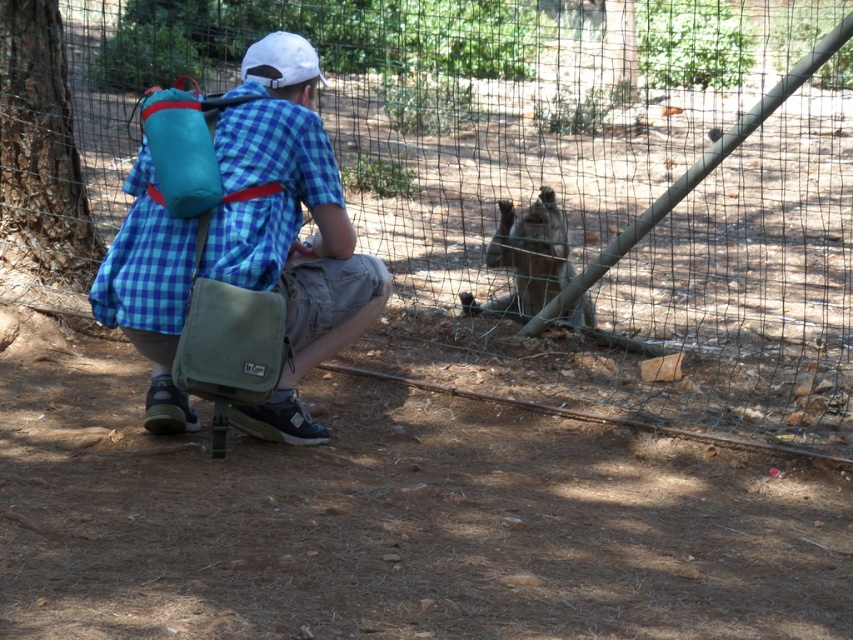
You are standing at the point labeled point (154, 154) and want to reach the point labeled point (645, 392). Which direction should you move to get closer to your destination?

You should move forward because point (645, 392) is further away from you than point (154, 154).

You are a hiker who wants to take a photo of the monkey behind the green mesh fence at center. However, your camera is in the teal fabric backpack at upper left. Can you reach the backpack without moving from your current position?

The green mesh fence at center is much taller than the teal fabric backpack at upper left, so you can reach the backpack without moving since it is shorter and located at your upper left.